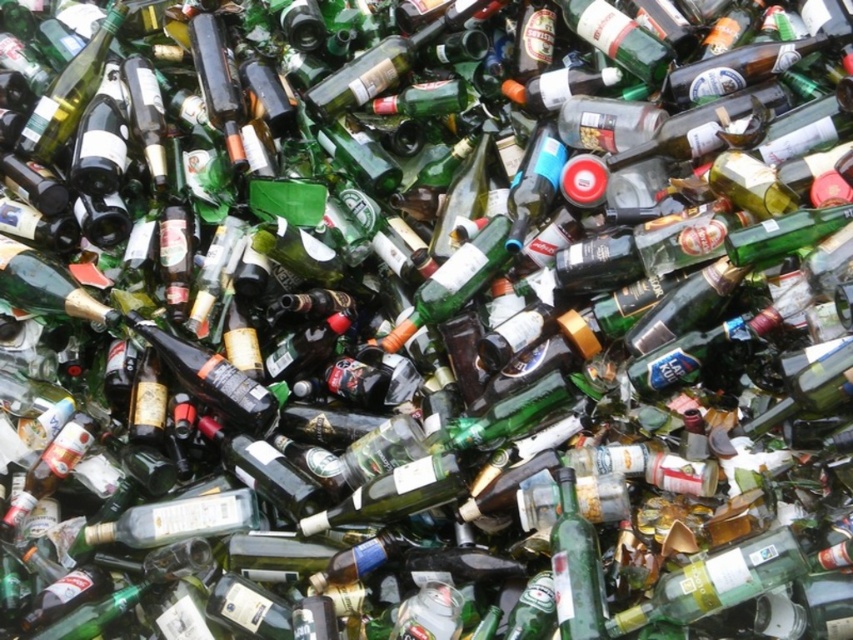
Is point (589, 586) closer to camera compared to point (209, 388)?

That is True.

Identify the location of green glass bottle at center. The height and width of the screenshot is (640, 853). (576, 566).

Does point (561, 506) come in front of point (178, 364)?

Yes, it is in front of point (178, 364).

The image size is (853, 640). Identify the location of green glass bottle at center. (576, 566).